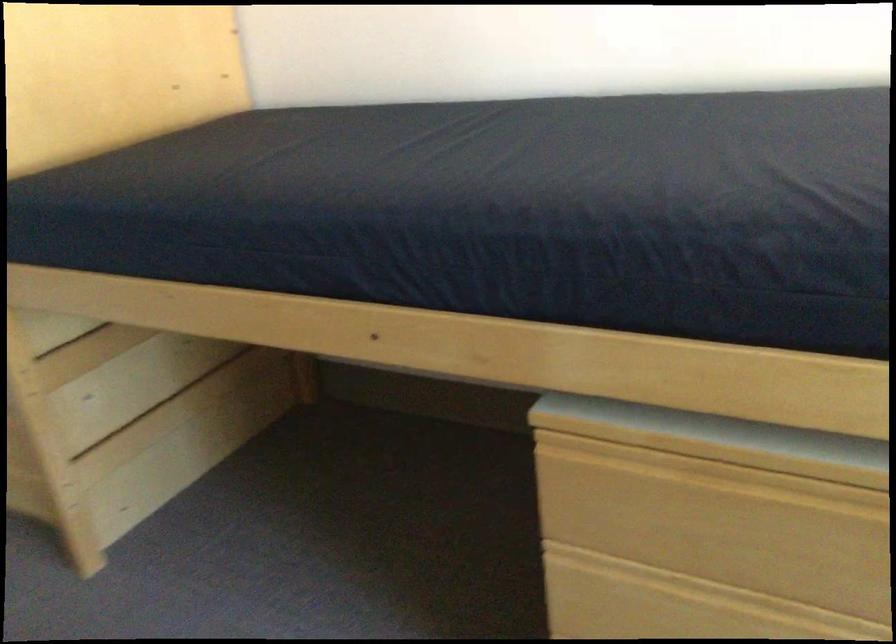
Question: The camera is either moving clockwise (left) or counter-clockwise (right) around the object. The first image is from the beginning of the video and the second image is from the end. Is the camera moving left or right when shooting the video?

Choices:
 (A) Left
 (B) Right

Answer: (A)